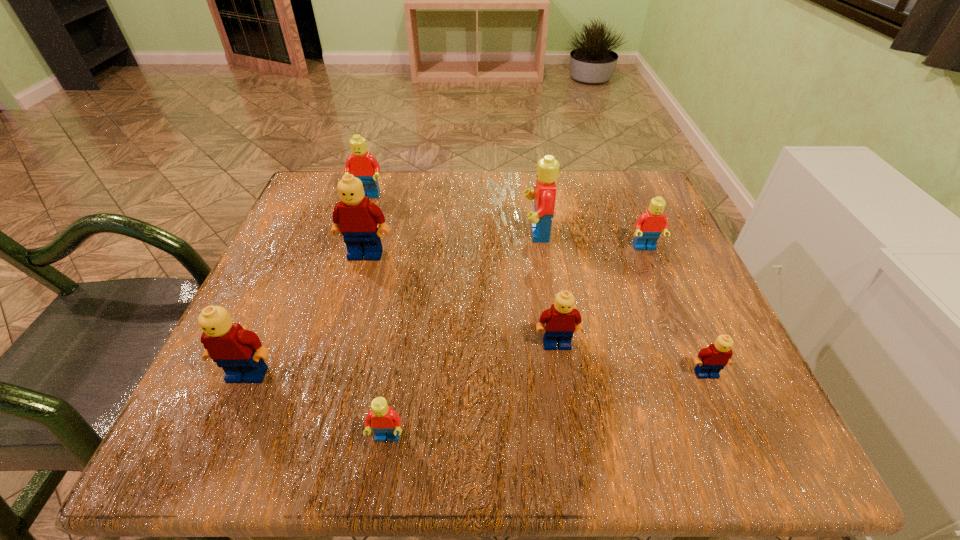
Where is `free space located on the front-facing side of the third biggest yellow Lego`? free space located on the front-facing side of the third biggest yellow Lego is located at coordinates (573, 453).

This screenshot has width=960, height=540. Identify the location of free space located 0.110m on the front-facing side of the rightmost yellow Lego. (738, 448).

In order to click on object that is at the near edge in this screenshot , I will do `click(385, 422)`.

Locate an element on the screen. The image size is (960, 540). object that is at the far left corner is located at coordinates (361, 164).

You are a GUI agent. You are given a task and a screenshot of the screen. Output one action in this format:
    pyautogui.click(x=<x>, y=<y>)
    Task: Click on the vacant point at the far edge
    
    Given the screenshot: What is the action you would take?
    pos(581,179)

Identify the location of vacant region at the near edge of the desktop. (482, 450).

The height and width of the screenshot is (540, 960). What are the coordinates of `vacant space at the left edge` in the screenshot? It's located at (332, 245).

Where is `blank space at the right edge of the desktop`? Image resolution: width=960 pixels, height=540 pixels. blank space at the right edge of the desktop is located at coordinates (679, 246).

I want to click on vacant area at the near left corner, so click(x=194, y=449).

Identify the location of vacant space at the far right corner. pyautogui.click(x=636, y=186).